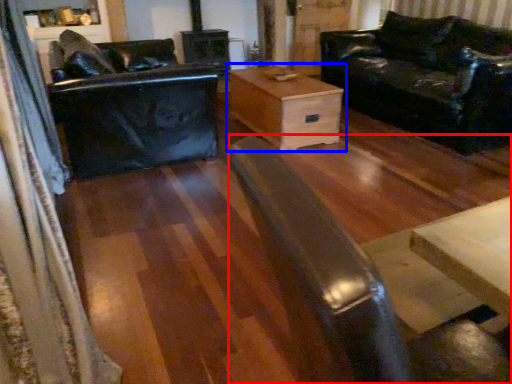
Question: Which point is closer to the camera, wide (highlighted by a red box) or table (highlighted by a blue box)?

Choices:
 (A) wide
 (B) table

Answer: (A)